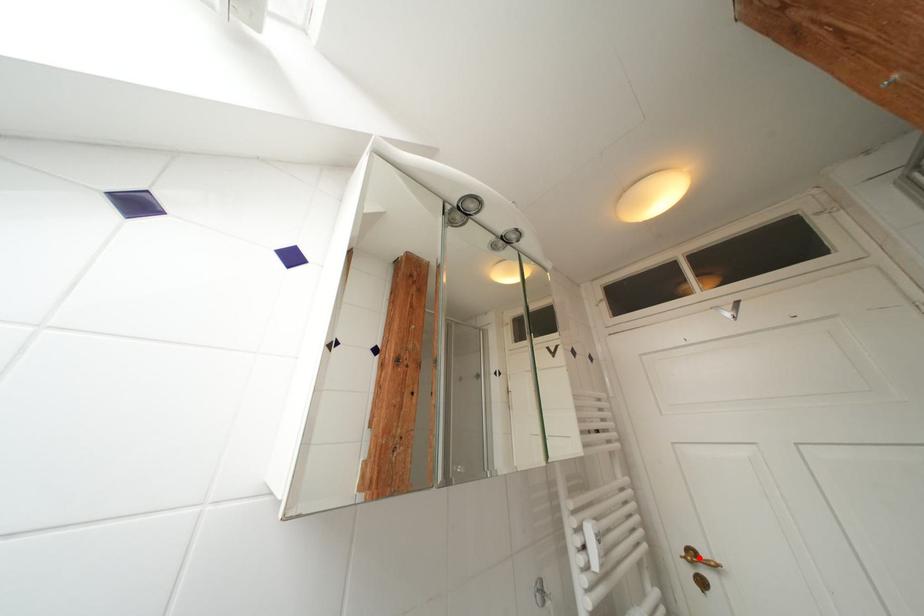
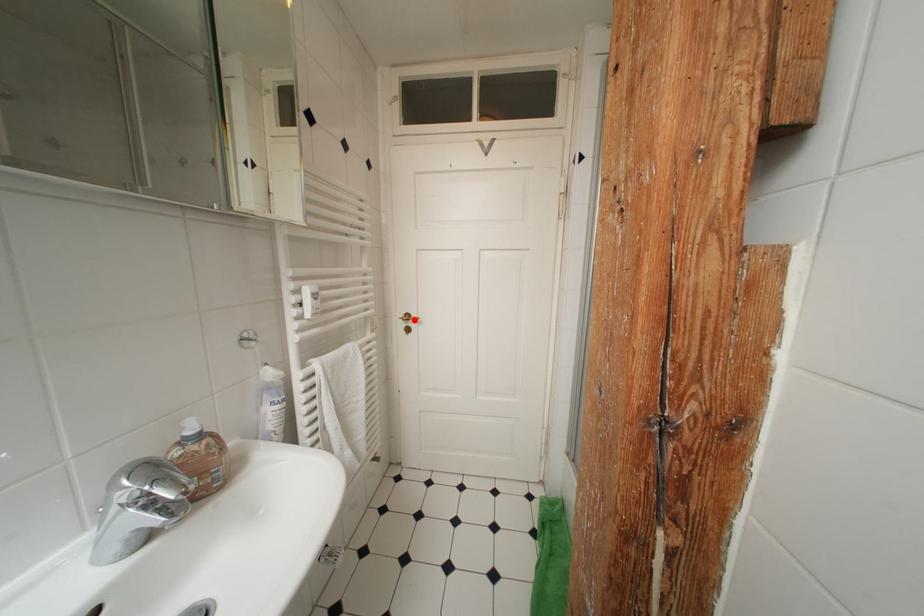
I am providing you with two images of the same scene from different viewpoints. A red point is marked on the first image and another point is marked on the second image. Are the points marked in image1 and image2 representing the same 3D position?

Yes